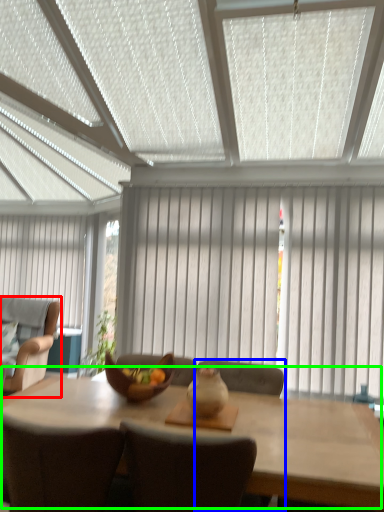
Question: Considering the real-world distances, which object is farthest from chair (highlighted by a red box)? chair (highlighted by a blue box) or kitchen & dining room table (highlighted by a green box)?

Choices:
 (A) chair
 (B) kitchen & dining room table

Answer: (A)